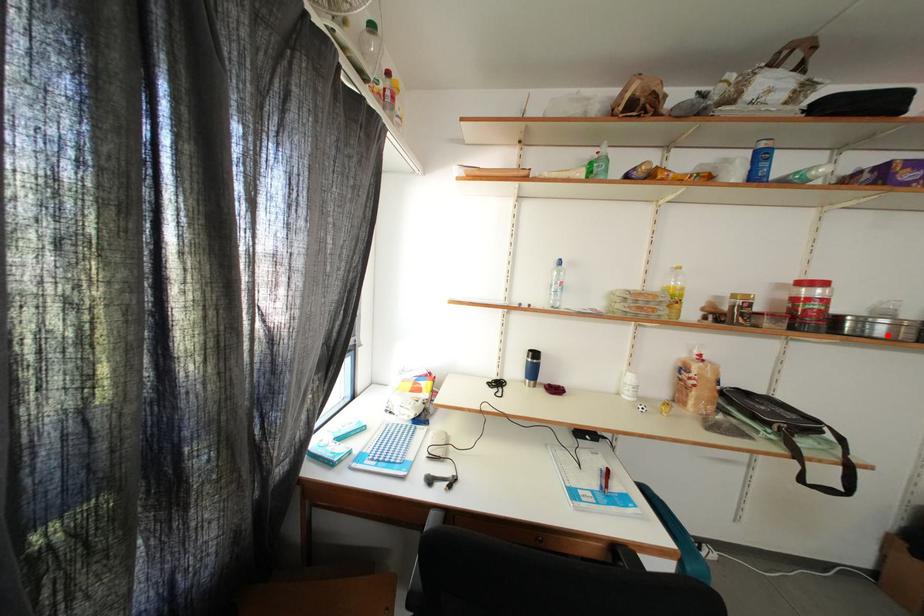
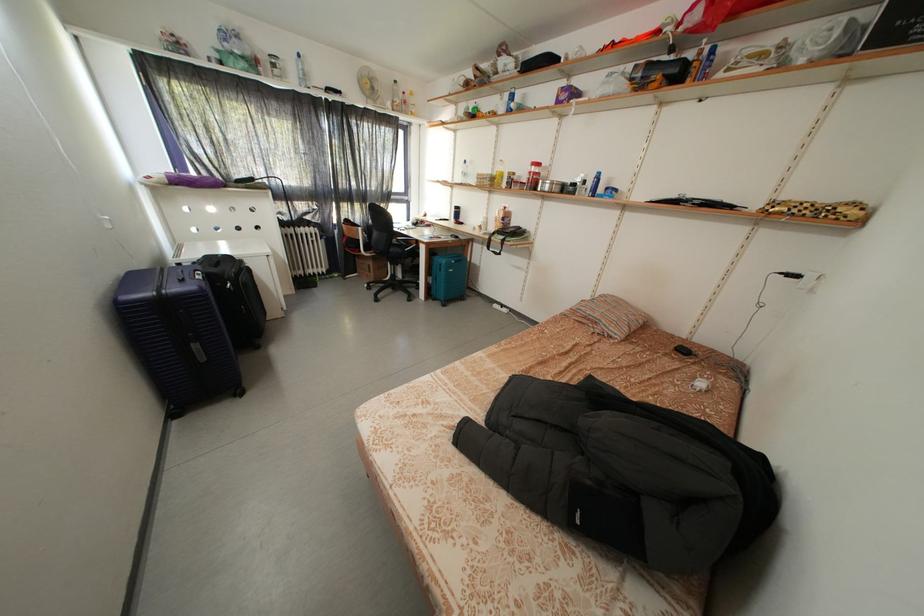
Where in the second image is the point corresponding to the highlighted location from the first image?

(554, 193)